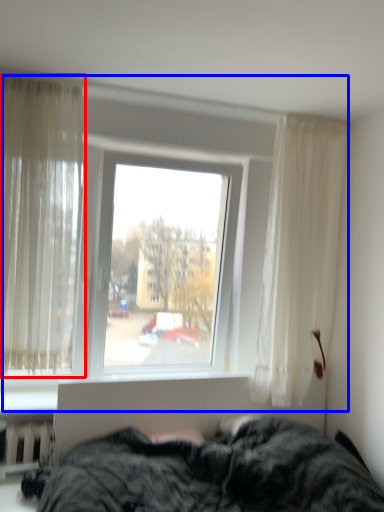
Question: Which object is closer to the camera taking this photo, curtain (highlighted by a red box) or window (highlighted by a blue box)?

Choices:
 (A) curtain
 (B) window

Answer: (A)